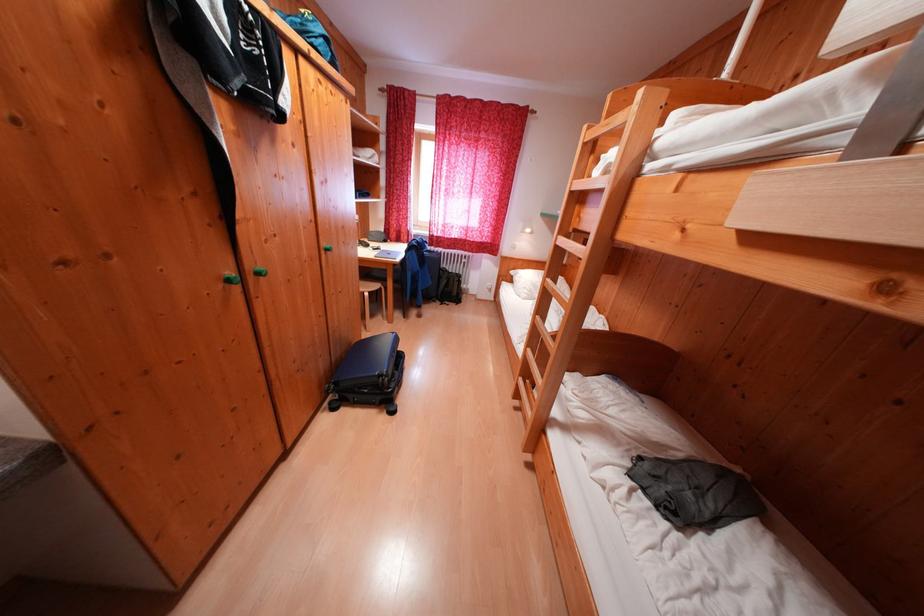
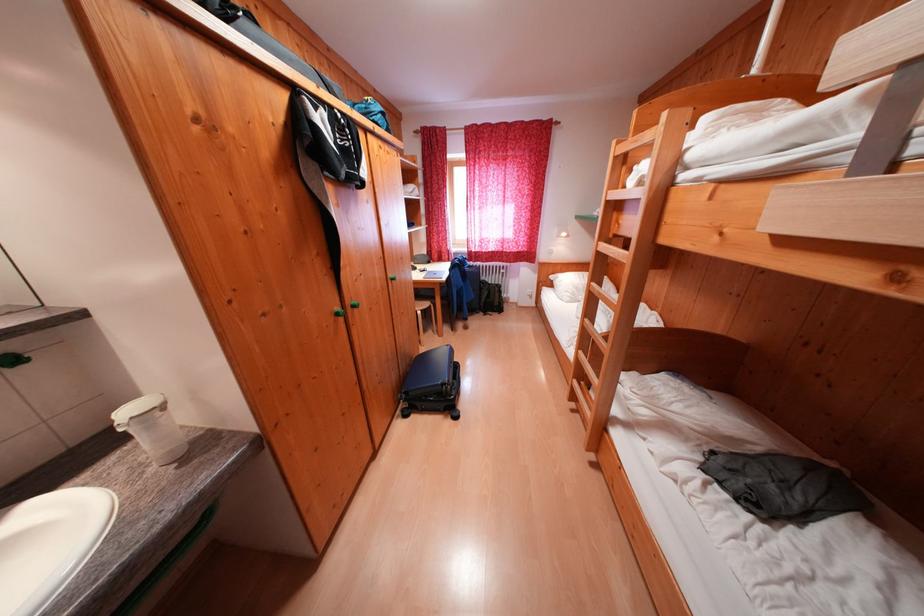
Find the pixel in the second image that matches (x=258, y=272) in the first image.

(357, 306)